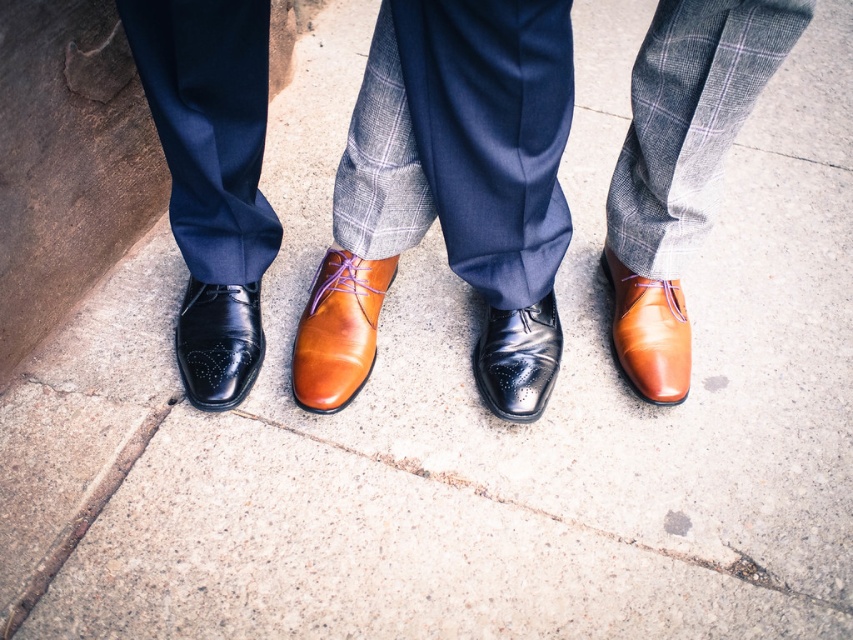
Question: Does black leather shoe at lower left have a smaller size compared to glossy leather shoe at center?

Choices:
 (A) yes
 (B) no

Answer: (A)

Question: Which of the following is the closest to the observer?

Choices:
 (A) (363, 339)
 (B) (498, 356)
 (C) (654, 378)

Answer: (B)

Question: Which of the following is the closest to the observer?

Choices:
 (A) (670, 355)
 (B) (506, 403)
 (C) (347, 358)

Answer: (B)

Question: Which of the following is the closest to the observer?

Choices:
 (A) glossy leather shoe at center
 (B) shiny brown leather shoe at center

Answer: (A)

Question: Observing the image, what is the correct spatial positioning of shiny brown leather shoe at center in reference to black leather shoe at lower left?

Choices:
 (A) left
 (B) right

Answer: (B)

Question: From the image, what is the correct spatial relationship of black leather shoe at lower left in relation to glossy leather shoe at center?

Choices:
 (A) above
 (B) below

Answer: (A)